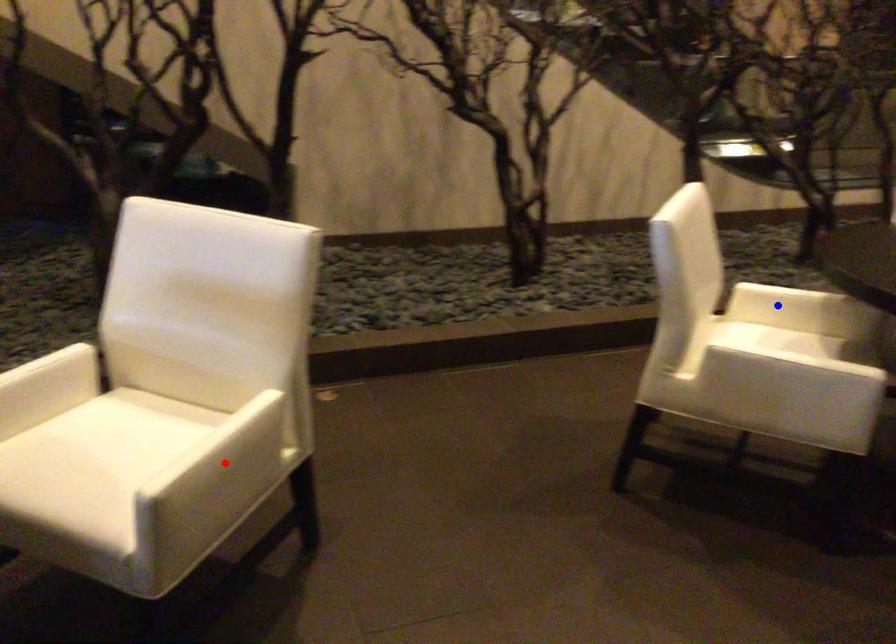
Question: Two points are marked on the image. Which point is closer to the camera?

Choices:
 (A) Blue point is closer.
 (B) Red point is closer.

Answer: (B)